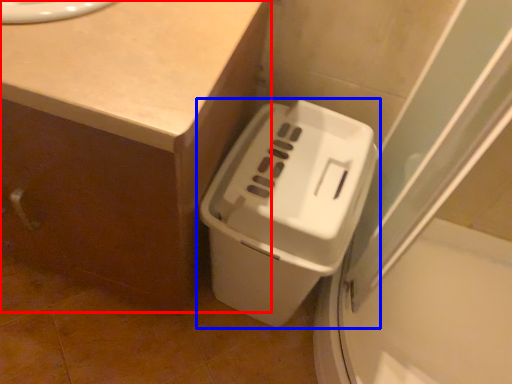
Question: Which point is further to the camera, counter (highlighted by a red box) or waste container (highlighted by a blue box)?

Choices:
 (A) counter
 (B) waste container

Answer: (B)